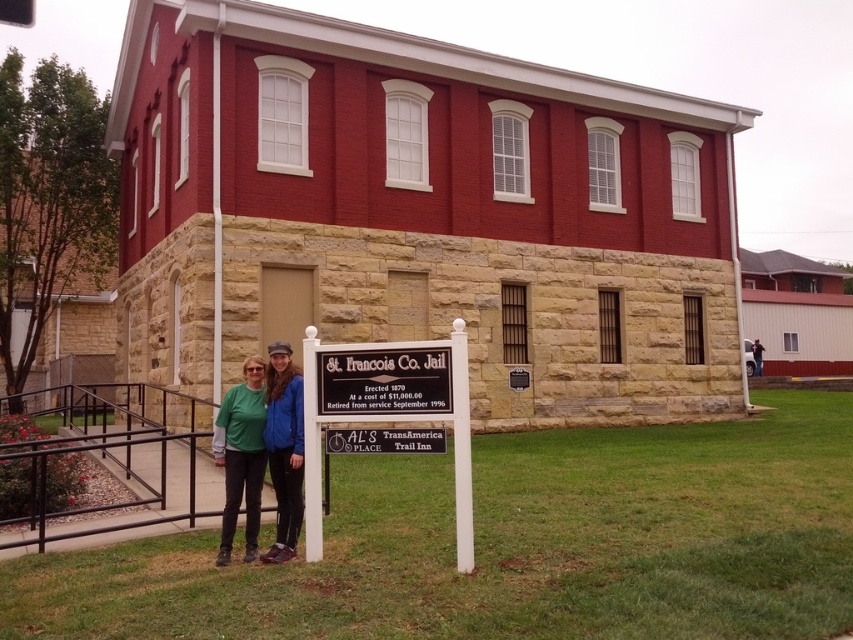
You are a visitor at the St. Francois Co. Jail and notice two items at the center of the scene. Which item is taller between the matte blue jacket at center and the dark blue jeans at center?

The matte blue jacket at center is taller than the dark blue jeans at center according to the description.

You are a visitor at the St. Francois Co. Jail and notice two items at the center of the scene. The green fabric at center and dark blue jeans at center. Which item is positioned higher up?

The green fabric at center is located above dark blue jeans at center, so it is positioned higher up.